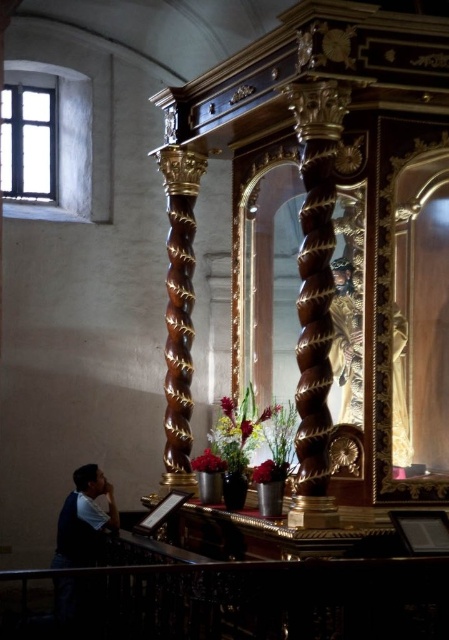
Find the location of `glossy metal balustrade at lower center`. glossy metal balustrade at lower center is located at coordinates (249, 600).

Is glossy metal balustrade at lower center bigger than glossy wood column at center?

Yes.

Which is behind, point (320, 586) or point (329, 152)?

Point (329, 152)

In order to click on glossy metal balustrade at lower center in this screenshot , I will do `click(249, 600)`.